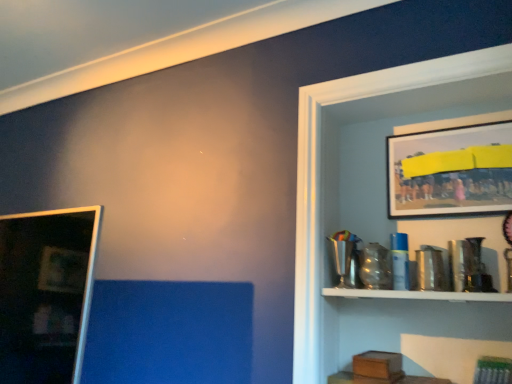
Question: Is metallic silver shelf at upper right bigger or smaller than metallic framed picture at upper right, the second picture frame viewed from the left?

Choices:
 (A) big
 (B) small

Answer: (A)

Question: From the image's perspective, relative to metallic framed picture at upper right, the second picture frame viewed from the left, is metallic silver shelf at upper right above or below?

Choices:
 (A) above
 (B) below

Answer: (B)

Question: Considering the real-world distances, which object is closest to the metallic framed picture at upper right, placed as the first picture frame when sorted from top to bottom?

Choices:
 (A) matte black picture frame at left, the first picture frame positioned from the bottom
 (B) metallic silver shelf at upper right

Answer: (B)

Question: Estimate the real-world distances between objects in this image. Which object is farther from the metallic framed picture at upper right, placed as the first picture frame when sorted from top to bottom?

Choices:
 (A) matte black picture frame at left, which ranks as the second picture frame in right-to-left order
 (B) metallic silver shelf at upper right

Answer: (A)